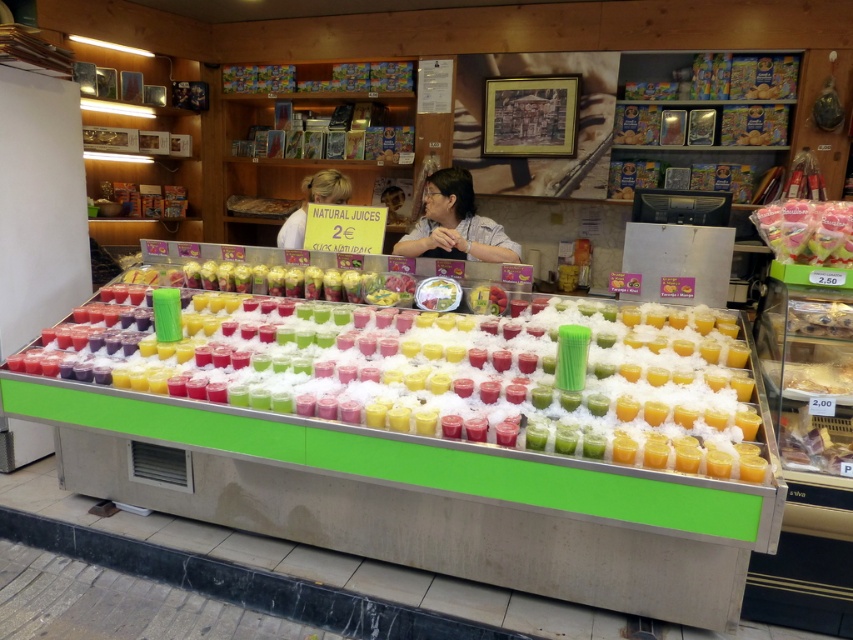
You are a customer at the juice stand and want to know which item is taller between the translucent plastic cups at center and the translucent plastic candy at upper right. Can you tell me?

The translucent plastic cups at center are taller than the translucent plastic candy at upper right.

You are a customer at the juice stand and want to choose between the matte gray shirt at center and the smooth white shirt at center. Which one is located to the right of the other?

The matte gray shirt at center is positioned on the right side of smooth white shirt at center.

You are a customer at the juice stand and want to pick up two translucent plastic cups at center. How far apart are they?

The translucent plastic cups at center are 5.84 feet apart.